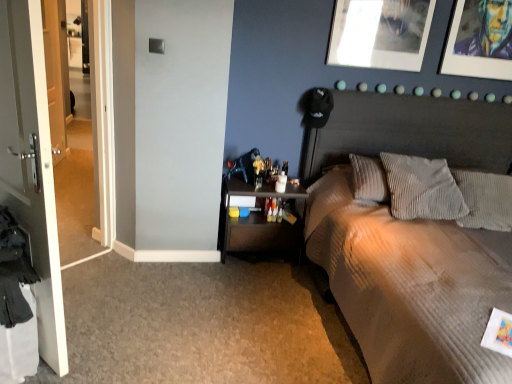
Identify the location of free area in between white glossy door at left and dark wood nightstand at lower center. (159, 296).